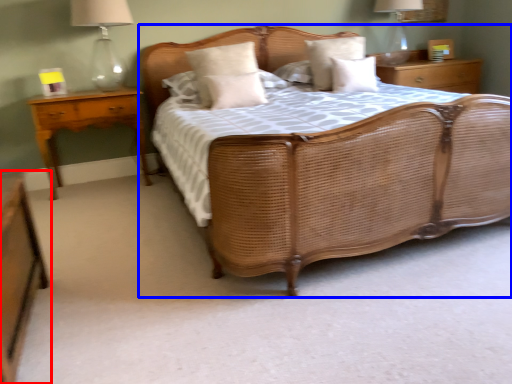
Question: Which object is further to the camera taking this photo, nightstand (highlighted by a red box) or bed (highlighted by a blue box)?

Choices:
 (A) nightstand
 (B) bed

Answer: (B)